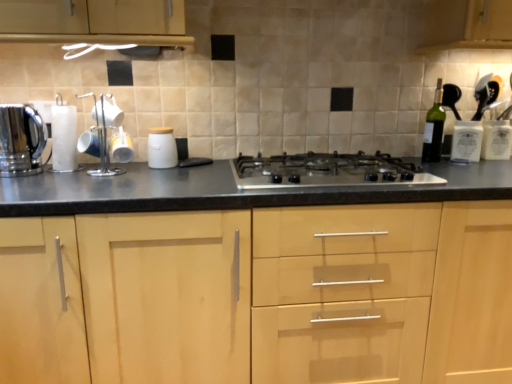
Question: Is light wood cabinet at center placed right next to white matte jar at center, the second kitchen appliance when ordered from left to right?

Choices:
 (A) yes
 (B) no

Answer: (B)

Question: Does light wood cabinet at center have a larger size compared to white matte jar at center, acting as the first kitchen appliance starting from the right?

Choices:
 (A) yes
 (B) no

Answer: (A)

Question: Is light wood cabinet at center smaller than white matte jar at center, the second kitchen appliance when ordered from left to right?

Choices:
 (A) yes
 (B) no

Answer: (B)

Question: Is white matte jar at center, the second kitchen appliance when ordered from left to right, at the back of light wood cabinet at center?

Choices:
 (A) yes
 (B) no

Answer: (B)

Question: Is light wood cabinet at center closer to camera compared to white matte jar at center, the second kitchen appliance when ordered from left to right?

Choices:
 (A) yes
 (B) no

Answer: (A)

Question: Based on their positions, is green glass bottle at right located to the left or right of light wood cabinet at center?

Choices:
 (A) left
 (B) right

Answer: (B)

Question: Looking at the image, does green glass bottle at right seem bigger or smaller compared to light wood cabinet at center?

Choices:
 (A) small
 (B) big

Answer: (A)

Question: Is point (424, 132) closer or farther from the camera than point (462, 286)?

Choices:
 (A) farther
 (B) closer

Answer: (A)

Question: From the image's perspective, relative to light wood cabinet at center, is green glass bottle at right above or below?

Choices:
 (A) above
 (B) below

Answer: (A)

Question: Considering the positions of green glass bottle at right and metallic cup rack at left in the image, is green glass bottle at right bigger or smaller than metallic cup rack at left?

Choices:
 (A) big
 (B) small

Answer: (B)

Question: Choose the correct answer: Is green glass bottle at right inside metallic cup rack at left or outside it?

Choices:
 (A) outside
 (B) inside

Answer: (A)

Question: In the image, is green glass bottle at right on the left side or the right side of metallic cup rack at left?

Choices:
 (A) left
 (B) right

Answer: (B)

Question: Is green glass bottle at right taller or shorter than metallic cup rack at left?

Choices:
 (A) tall
 (B) short

Answer: (A)

Question: Considering the positions of white matte jar at center, acting as the first kitchen appliance starting from the right, and light wood cabinet at center in the image, is white matte jar at center, acting as the first kitchen appliance starting from the right, bigger or smaller than light wood cabinet at center?

Choices:
 (A) small
 (B) big

Answer: (A)

Question: From the image's perspective, is white matte jar at center, acting as the first kitchen appliance starting from the right, located above or below light wood cabinet at center?

Choices:
 (A) above
 (B) below

Answer: (A)